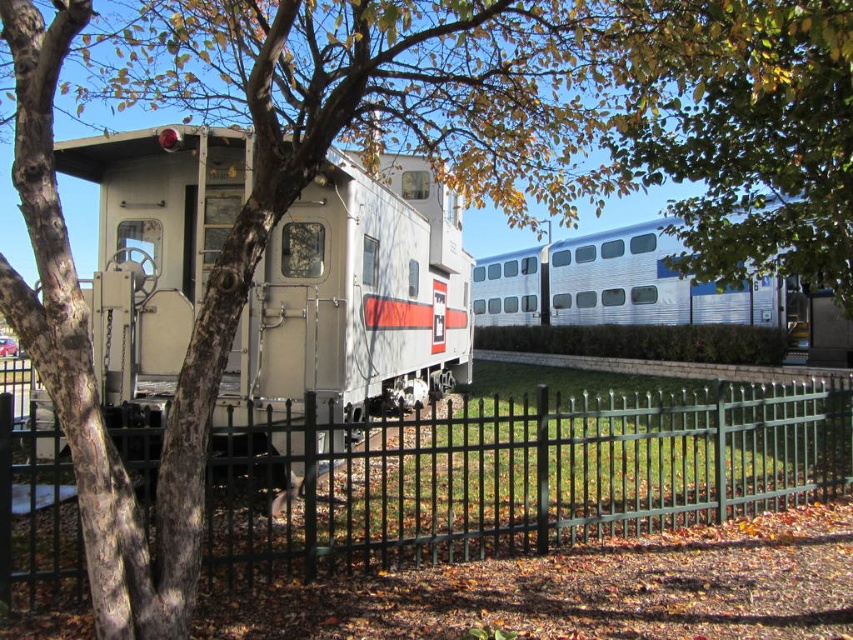
You are standing in front of the vintage train car and want to take a photo of both the point at coordinates (x=109, y=221) and the point at (x=804, y=8). Which point will appear closer to the camera in your photo?

Point (x=109, y=221) is further to the camera than point (x=804, y=8), so in the photo, point (x=109, y=221) will appear closer to the camera than point (x=804, y=8).

You are standing at the entrance of the railway museum and notice two objects in the scene. One is the green metal fence at center and the other is the green leafy tree at upper center. Based on their positions, which object is closer to the left side of the image?

The green metal fence at center is positioned to the left of the green leafy tree at upper center, so the green metal fence at center is closer to the left side of the image.